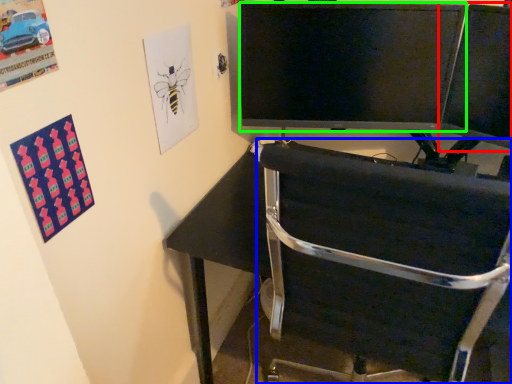
Question: Which is farther away from computer monitor (highlighted by a red box)? chair (highlighted by a blue box) or television (highlighted by a green box)?

Choices:
 (A) chair
 (B) television

Answer: (A)